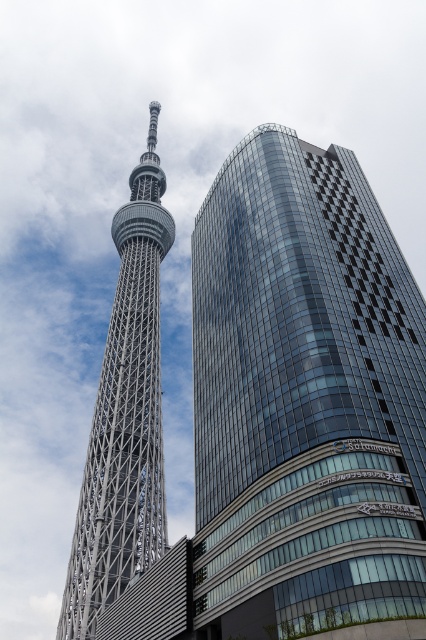
You are standing at the center of the image and want to locate the shiny glass skyscraper at center. According to the coordinates provided, in which direction should you look to find it?

The shiny glass skyscraper at center is located at coordinates point [302,396], which means it is positioned to the right and slightly below the center point. Therefore, you should look to the lower right direction from the center to find it.

Looking at this image, you are standing in front of the Tokyo Skytree and the shiny glass skyscraper at center. You want to take a photo that includes both structures in the frame. Based on their distances from you, which structure should you position closer to the edge of the frame to ensure both are visible?

The shiny glass skyscraper at center is 139.99 feet from the camera, so to include both the Tokyo Skytree and the shiny glass skyscraper at center in the frame, you should position the Tokyo Skytree closer to the edge of the frame since it is farther away compared to the skyscraper.

You are standing in the middle of a park between the shiny glass skyscraper at center and the silver metallic tower at left. You want to take a photo of both structures. Which structure should you move towards to get a clearer view of the other?

You should move towards the silver metallic tower at left to get a clearer view of the shiny glass skyscraper at center because it is closer to you, so moving closer to the tower would reduce the distance to the skyscraper.